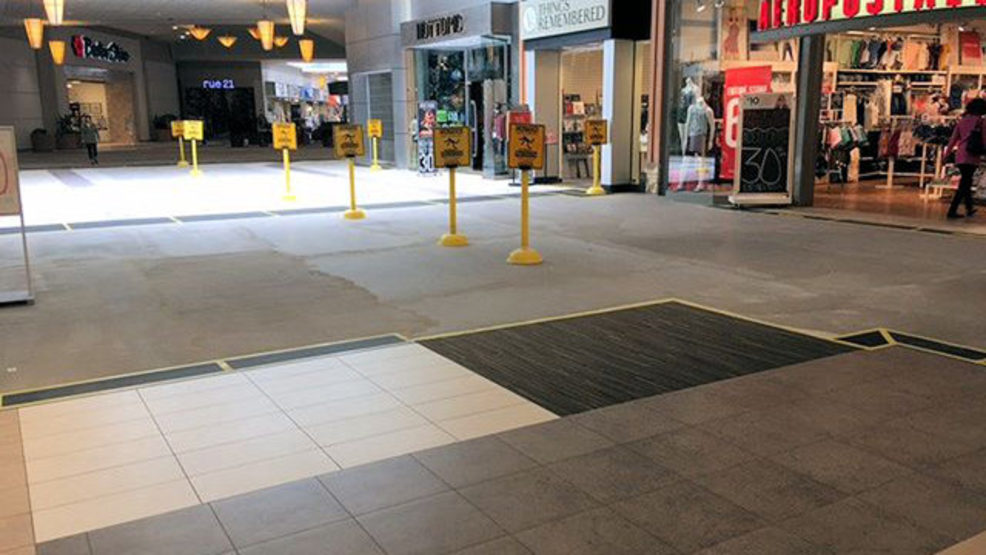
Find the location of `wet floor sign`. wet floor sign is located at coordinates (522, 228), (455, 165), (340, 144), (286, 134), (189, 129), (174, 128), (373, 128), (596, 135).